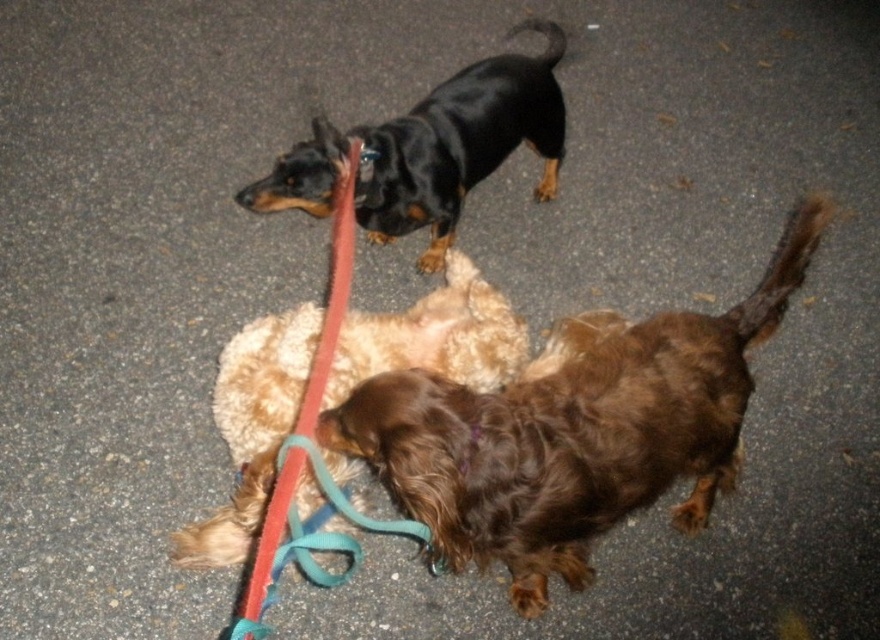
You are standing at the point marked by the coordinates point (251, 428). Looking around, you see a fuzzy brown dog at center. Which direction should you move to get closer to the fuzzy brown dog at center?

The point (251, 428) is already on the fuzzy brown dog at center, so you are already at the location of the fuzzy brown dog at center. There is no need to move further.

You are a dog owner who wants to buy a new dog bed. The bed you want is designed for dogs shorter than the black glossy dog at upper center. You have a fuzzy brown dog at center. Will the bed fit your dog?

The fuzzy brown dog at center is shorter than the black glossy dog at upper center, so the bed designed for dogs shorter than the black glossy dog at upper center will fit the fuzzy brown dog at center.